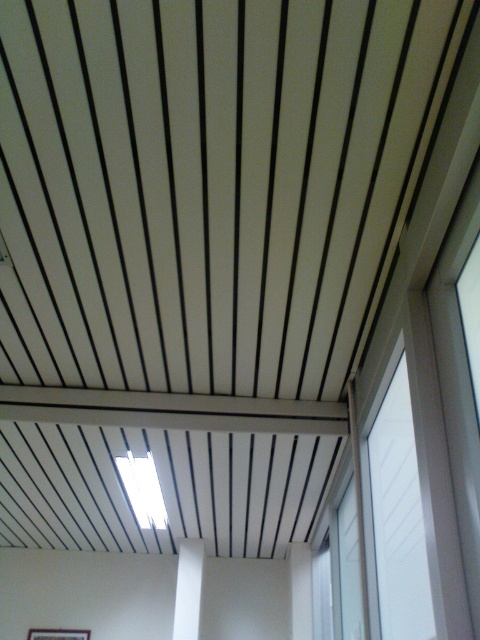
Question: Which of the following is the farthest from the observer?

Choices:
 (A) (411, 412)
 (B) (172, 634)

Answer: (B)

Question: From the image, what is the correct spatial relationship of white glossy window at right in relation to white matte pillar at center?

Choices:
 (A) above
 (B) below

Answer: (A)

Question: Can you confirm if white glossy window at right is bigger than white matte pillar at center?

Choices:
 (A) yes
 (B) no

Answer: (A)

Question: Which of the following is the farthest from the observer?

Choices:
 (A) white glossy window at right
 (B) white matte pillar at center

Answer: (B)

Question: Can you confirm if white glossy window at right is smaller than white matte pillar at center?

Choices:
 (A) no
 (B) yes

Answer: (A)